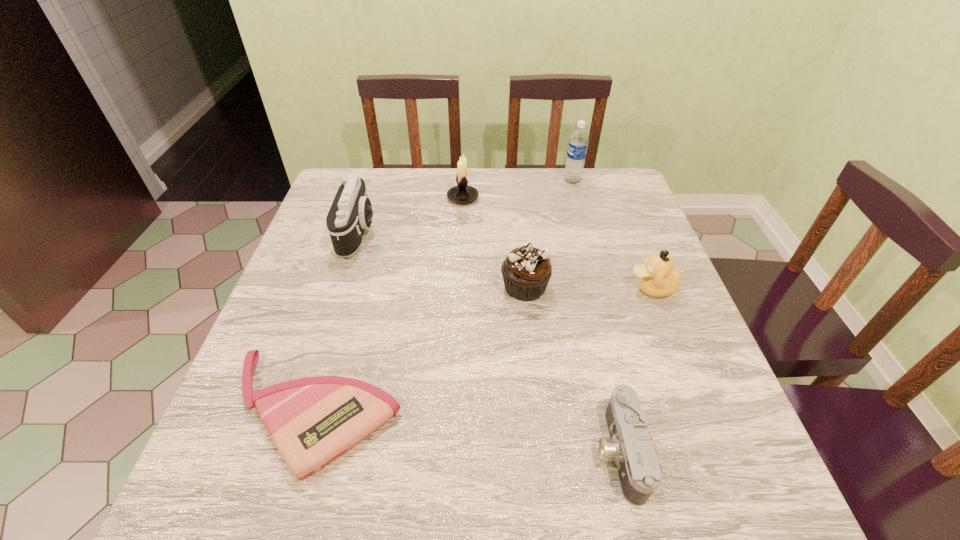
Identify the location of object that is positioned at the far left corner. (351, 213).

The image size is (960, 540). Identify the location of object at the near left corner. (312, 421).

Where is `object located in the far right corner section of the desktop`? The image size is (960, 540). object located in the far right corner section of the desktop is located at coordinates (578, 143).

Locate an element on the screen. Image resolution: width=960 pixels, height=540 pixels. free location at the far edge is located at coordinates (522, 171).

In the image, there is a desktop. Find the location of `vacant space at the near edge`. vacant space at the near edge is located at coordinates (393, 502).

The height and width of the screenshot is (540, 960). I want to click on free region at the left edge of the desktop, so click(x=346, y=273).

This screenshot has width=960, height=540. In the image, there is a desktop. In order to click on vacant space at the right edge in this screenshot , I will do `click(707, 408)`.

You are a GUI agent. You are given a task and a screenshot of the screen. Output one action in this format:
    pyautogui.click(x=<x>, y=<y>)
    Task: Click on the free space at the far right corner
    This screenshot has width=960, height=540.
    Given the screenshot: What is the action you would take?
    pyautogui.click(x=580, y=191)

What are the coordinates of `unoccupied position between the duckling and the cupcake` in the screenshot? It's located at (588, 288).

Identify the location of vacant area that lies between the third object from left to right and the farther camera. Image resolution: width=960 pixels, height=540 pixels. (411, 215).